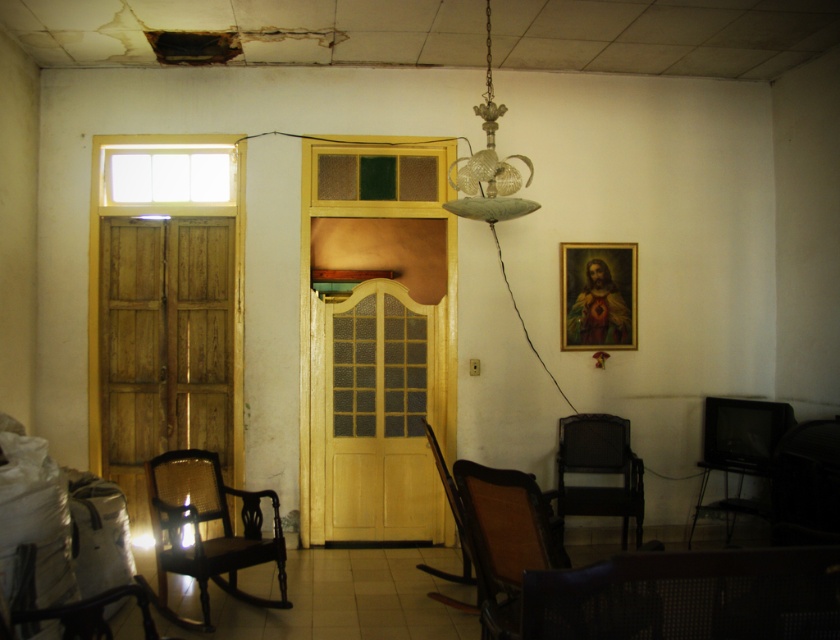
You are sitting on the floor in the center of the room and want to move to the door on the left. Which object, the dark brown woven chair at lower right or the woven brown armchair at lower right, is closer to your current position?

The woven brown armchair at lower right is closer to your current position because the dark brown woven chair at lower right is above it, meaning it is further away from the center of the room.

You are standing at the entrance of the room. You want to sit down in the dark brown cane armchair at left. Which direction should you walk to reach it?

You should walk to the left to reach the dark brown cane armchair at left since it is located on the left side of the room.